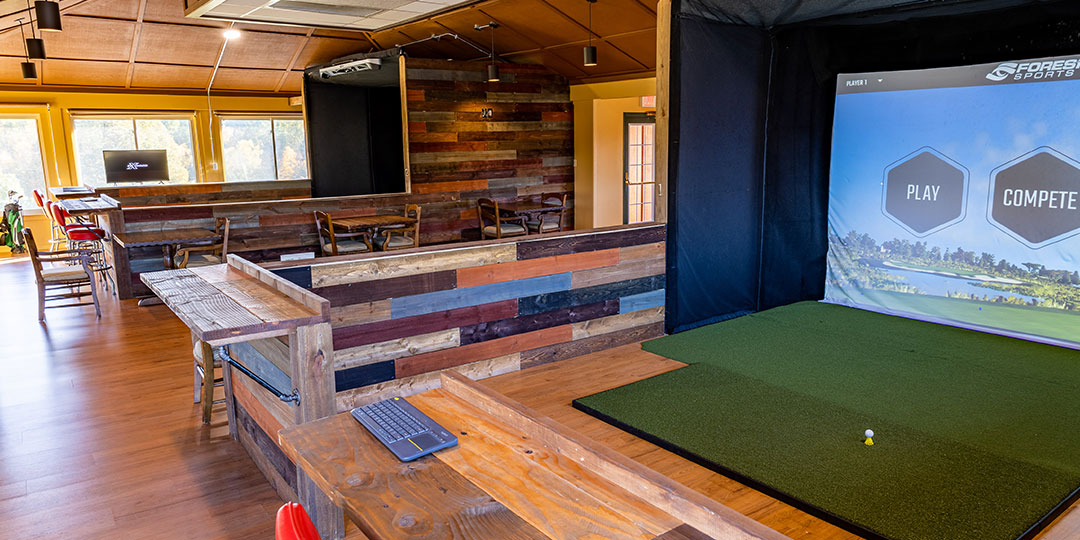
At what (x,y) coordinates should I click in order to perform the action: click on keyboard. Please return your answer as a coordinate pair (x, y). Looking at the image, I should click on (409, 433).